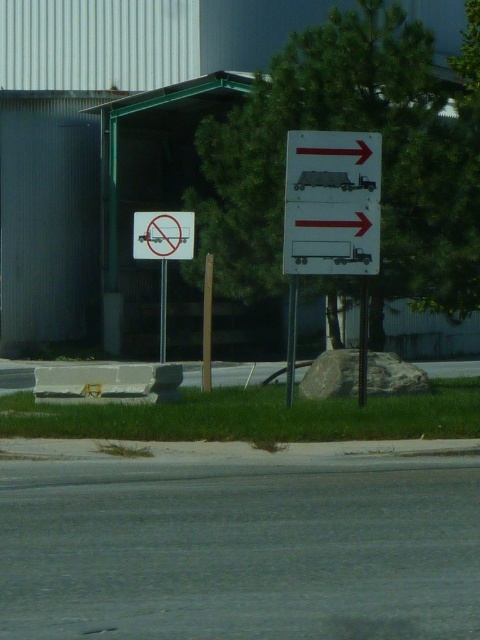
You are a delivery driver who needs to know if your matte white truck at upper right can pass under the white plastic sign at center without hitting it. Based on the scene description, can you safely drive under the sign?

The matte white truck at upper right has a greater height compared to the white plastic sign at center. This means the truck is taller than the sign, so driving under it would likely result in a collision. Therefore, it is not safe to proceed under the white plastic sign at center.

Based on the provided scene description, what object is located at the coordinates point (x=163, y=236)?

The white plastic sign at center is located at point (x=163, y=236).